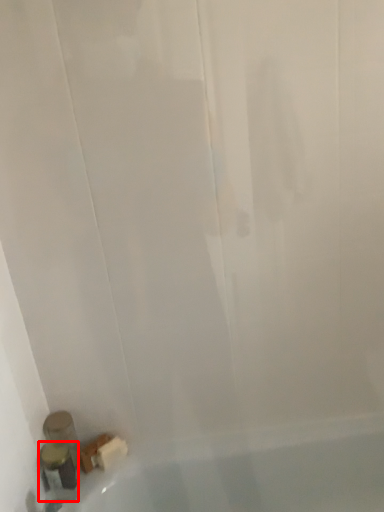
Question: From the image's perspective, where is toiletry (annotated by the red box) located in relation to toiletry in the image?

Choices:
 (A) above
 (B) below

Answer: (B)